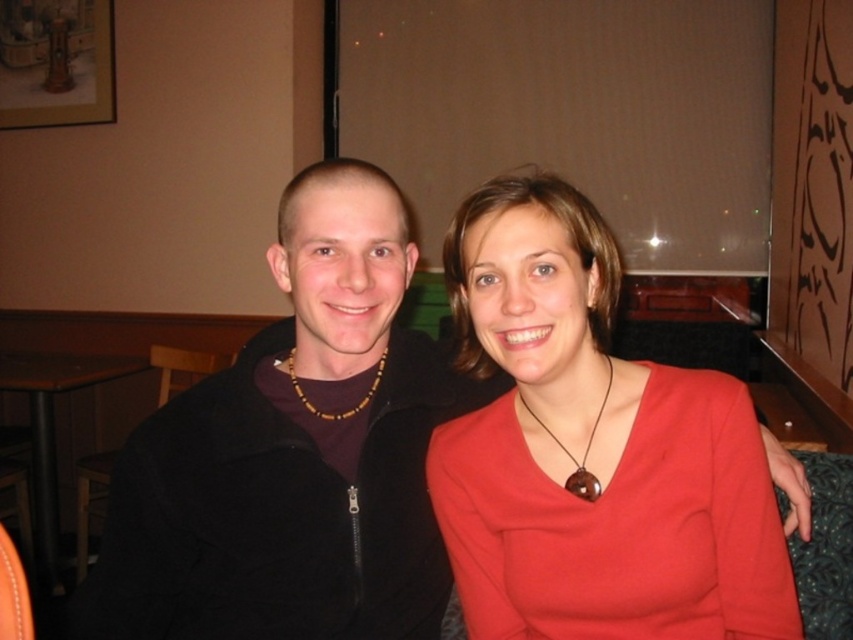
Question: Estimate the real-world distances between objects in this image. Which object is closer to the brown wood pendant at center?

Choices:
 (A) brown wooden beads at center
 (B) brown wooden table at lower left
 (C) black matte jacket at left

Answer: (A)

Question: Does brown wood pendant at center come behind brown wooden beads at center?

Choices:
 (A) yes
 (B) no

Answer: (B)

Question: Is matte red blouse at center closer to camera compared to brown wooden beads at center?

Choices:
 (A) yes
 (B) no

Answer: (A)

Question: Which of the following is the farthest from the observer?

Choices:
 (A) (21, 356)
 (B) (592, 428)

Answer: (A)

Question: Is brown wood pendant at center positioned behind brown wooden beads at center?

Choices:
 (A) no
 (B) yes

Answer: (A)

Question: Which object is farther from the camera taking this photo?

Choices:
 (A) brown wood pendant at center
 (B) brown wooden beads at center

Answer: (B)